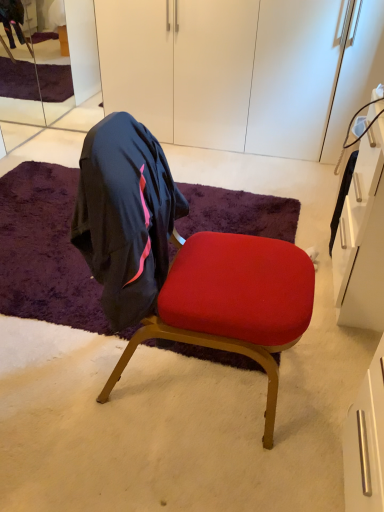
Question: Visually, is velvet red chair at center positioned to the left or to the right of white matte cabinet at upper center?

Choices:
 (A) left
 (B) right

Answer: (A)

Question: From the image's perspective, is velvet red chair at center positioned above or below white matte cabinet at upper center?

Choices:
 (A) below
 (B) above

Answer: (A)

Question: Which object is the closest to the velvet red chair at center?

Choices:
 (A) white matte cabinet at upper center
 (B) clear glass mirror at upper left
 (C) purple shaggy rug at center

Answer: (C)

Question: Which object is the closest to the clear glass mirror at upper left?

Choices:
 (A) velvet red chair at center
 (B) purple shaggy rug at center
 (C) white matte cabinet at upper center

Answer: (B)